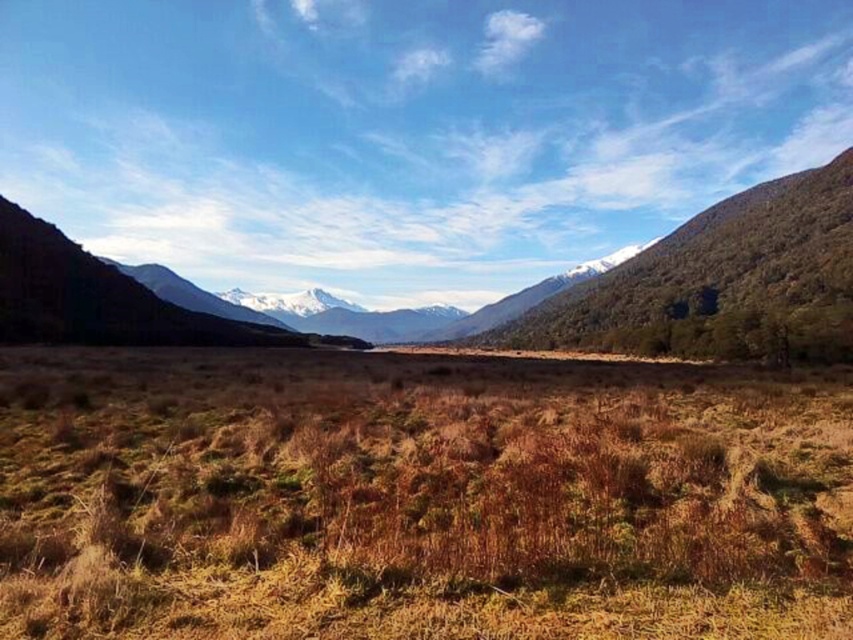
Question: Among these objects, which one is farthest from the camera?

Choices:
 (A) brown dry grass at center
 (B) green grassy field at center

Answer: (B)

Question: Is brown dry grass at center wider than green grassy field at center?

Choices:
 (A) yes
 (B) no

Answer: (B)

Question: Is brown dry grass at center smaller than green grassy field at center?

Choices:
 (A) yes
 (B) no

Answer: (A)

Question: Which point is closer to the camera?

Choices:
 (A) (769, 301)
 (B) (660, 620)

Answer: (B)

Question: Is brown dry grass at center positioned in front of green grassy field at center?

Choices:
 (A) yes
 (B) no

Answer: (A)

Question: Which point is farther to the camera?

Choices:
 (A) (381, 397)
 (B) (595, 336)

Answer: (B)